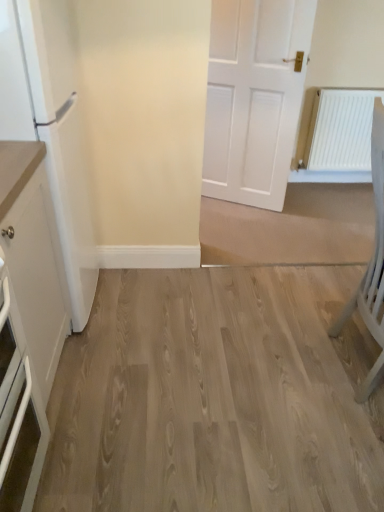
Locate an element on the screen. The image size is (384, 512). vacant space in front of light gray wooden chair at right is located at coordinates (340, 452).